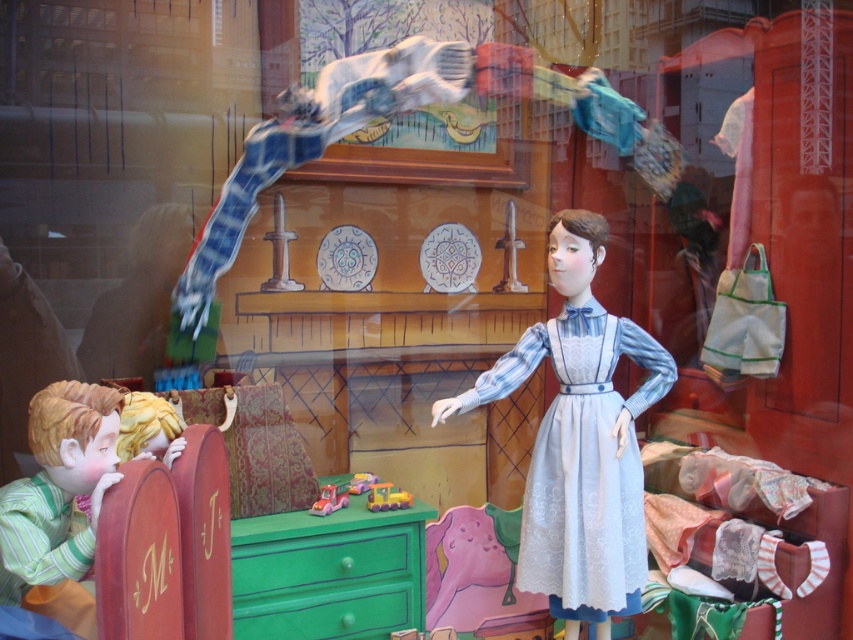
Does green painted wood drawer at lower center appear on the right side of pastel plastic toy car at center?

In fact, green painted wood drawer at lower center is to the left of pastel plastic toy car at center.

Is point (289, 611) farther from viewer compared to point (328, 490)?

That is False.

What do you see at coordinates (329, 618) in the screenshot?
I see `green painted wood drawer at lower center` at bounding box center [329, 618].

This screenshot has height=640, width=853. Identify the location of green painted wood drawer at lower center. (329, 618).

Does green striped fabric at left appear under rubber yellow car at center?

No.

Does green striped fabric at left appear on the right side of rubber yellow car at center?

No, green striped fabric at left is not to the right of rubber yellow car at center.

The image size is (853, 640). What do you see at coordinates (57, 500) in the screenshot?
I see `green striped fabric at left` at bounding box center [57, 500].

The height and width of the screenshot is (640, 853). Find the location of `green striped fabric at left`. green striped fabric at left is located at coordinates (57, 500).

Measure the distance from plastic toy truck at center to pastel plastic toy car at center.

plastic toy truck at center is 2.11 inches away from pastel plastic toy car at center.

Is plastic toy truck at center positioned behind pastel plastic toy car at center?

That is False.

At what (x,y) coordinates should I click in order to perform the action: click on plastic toy truck at center. Please return your answer as a coordinate pair (x, y). Looking at the image, I should click on (358, 493).